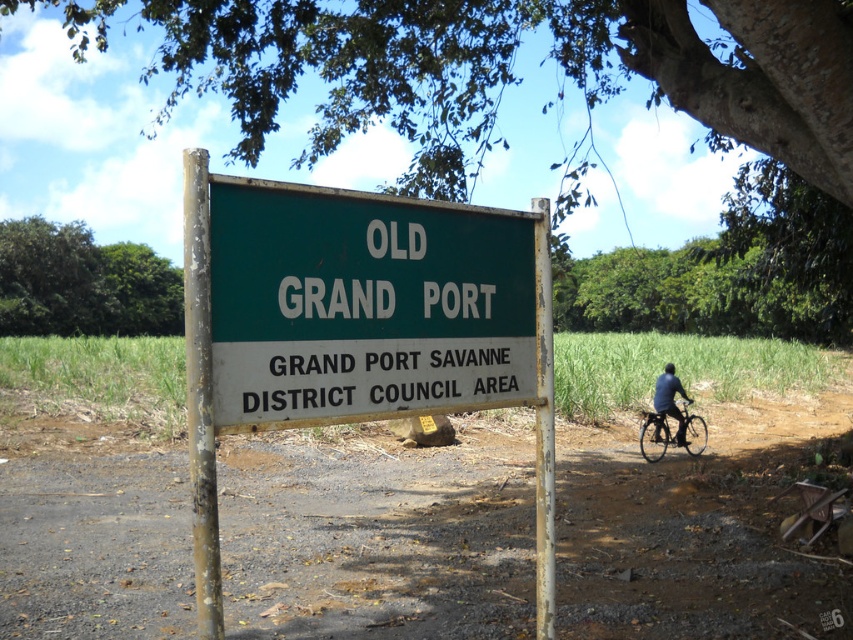
You are a cyclist approaching the green painted metal sign at center and the shiny black bicycle at right. Which object is higher in the image?

The green painted metal sign at center is higher than the shiny black bicycle at right in the image.

You are standing at the signpost and want to reach the point marked as point (657, 442). Which direction should you walk to avoid going past point (331, 337)?

Since point (331, 337) is in front of point (657, 442), you should walk towards the direction away from point (331, 337) to reach point (657, 442) without passing it.

You are standing at the signpost and want to know which of the two points, point (589, 509) or point (805, 116), is closer to you. Can you determine this based on their positions?

Point (805, 116) is closer to you because it is less further to the camera than point (589, 509).